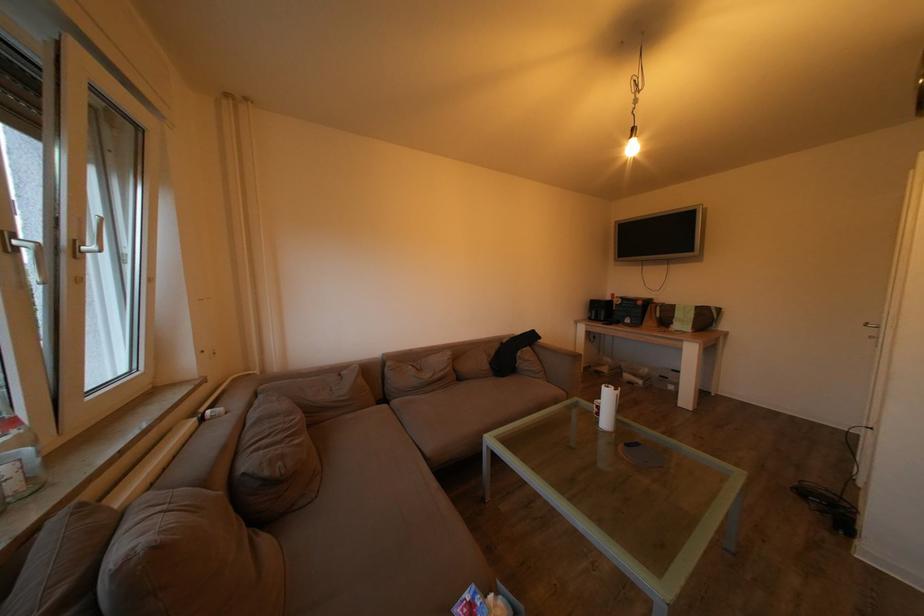
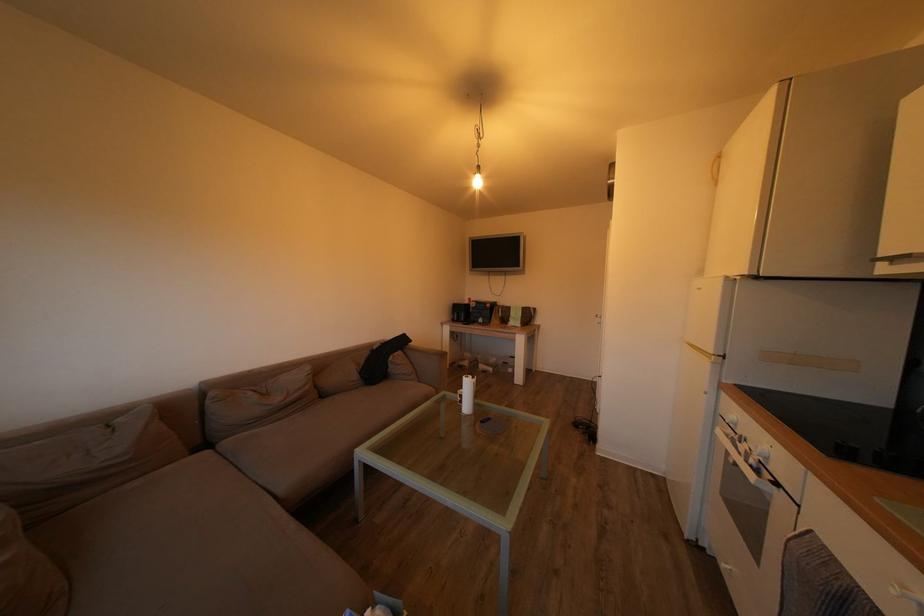
Locate, in the second image, the point that corresponds to pixel 681 313 in the first image.

(517, 314)